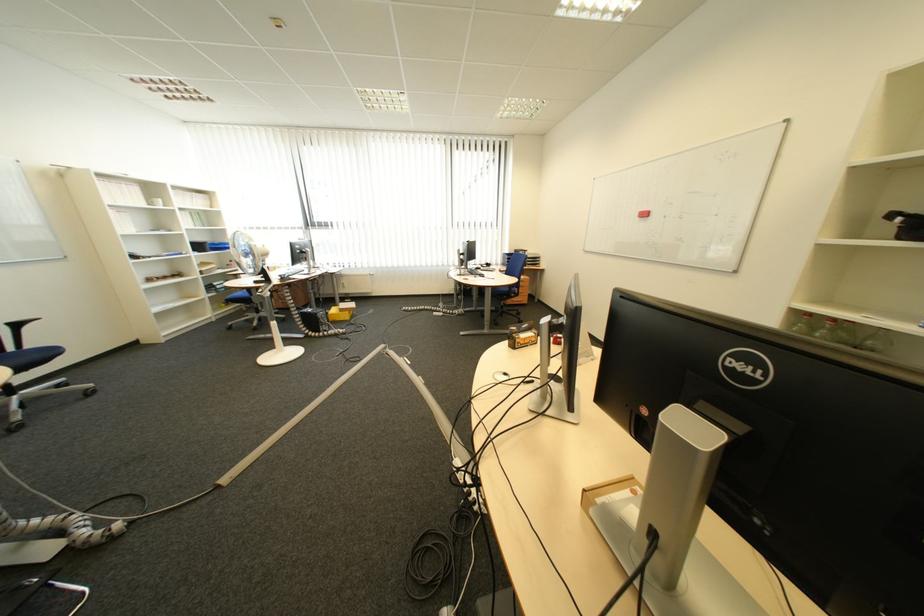
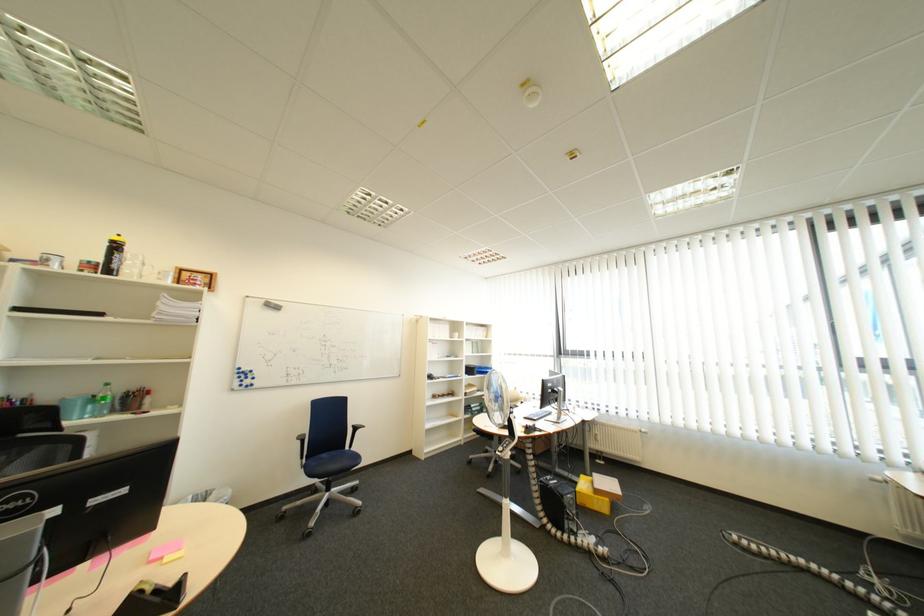
Find the pixel in the second image that matches point 335,317 in the first image.

(585, 503)